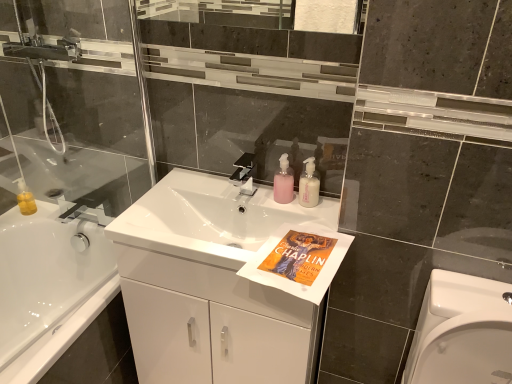
The height and width of the screenshot is (384, 512). What are the coordinates of `vacant space that is to the left of satin nickel faucet at center` in the screenshot? It's located at (198, 192).